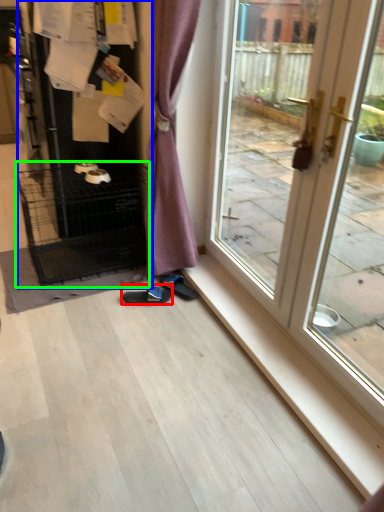
Question: Which is farther away from footwear (highlighted by a red box)? appliance (highlighted by a blue box) or cage (highlighted by a green box)?

Choices:
 (A) appliance
 (B) cage

Answer: (A)